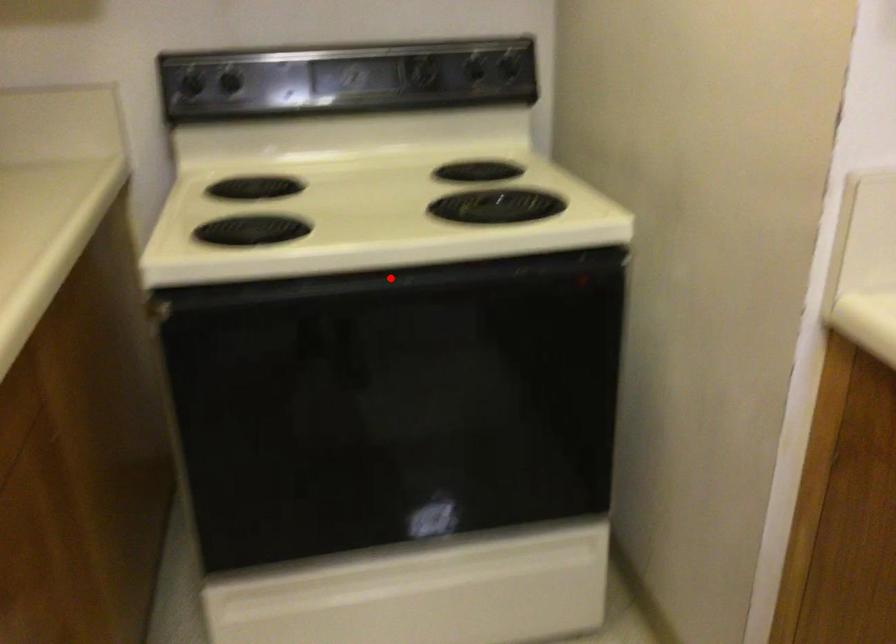
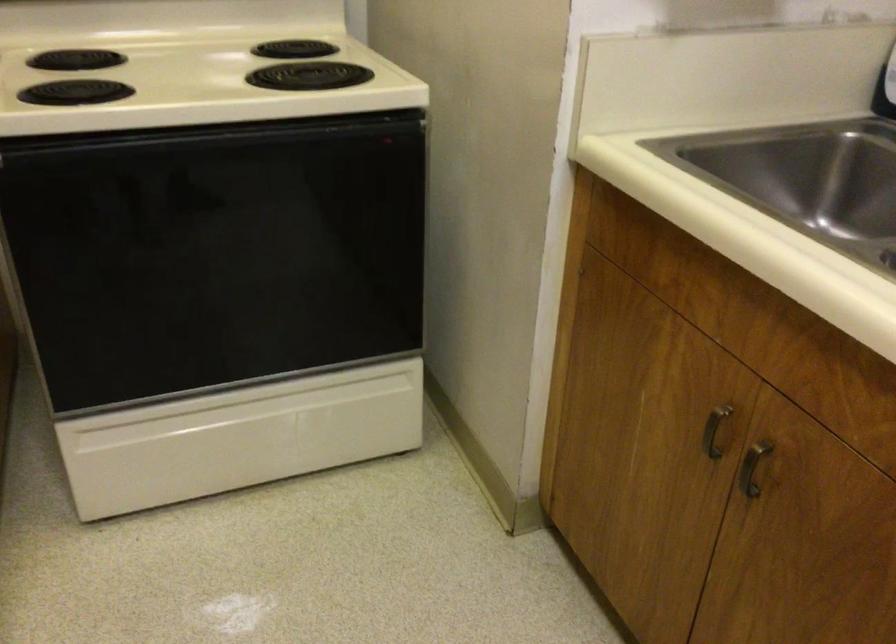
Question: I am providing you with two images of the same scene from different viewpoints. In image1, a red point is highlighted. Considering the same 3D point in image2, which of the following is correct?

Choices:
 (A) It is closer
 (B) It is farther

Answer: (B)